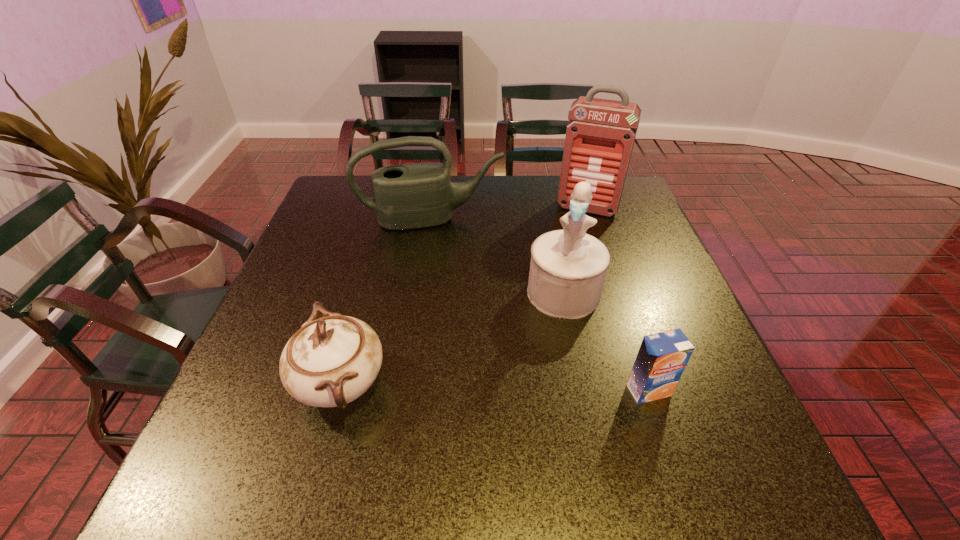
Find the location of a particular element. This screenshot has width=960, height=540. orange_juice present at the near edge is located at coordinates (662, 357).

What are the coordinates of `chinaware that is positioned at the left edge` in the screenshot? It's located at (329, 362).

Identify the location of watering can present at the left edge. (417, 195).

Identify the location of orange_juice present at the right edge. (662, 357).

This screenshot has width=960, height=540. What are the coordinates of `the first-aid kit positioned at the right edge` in the screenshot? It's located at (600, 135).

Find the location of `object located in the far left corner section of the desktop`. object located in the far left corner section of the desktop is located at coordinates (417, 195).

This screenshot has width=960, height=540. What are the coordinates of `object situated at the near left corner` in the screenshot? It's located at (329, 362).

Locate an element on the screen. The image size is (960, 540). object present at the far right corner is located at coordinates (600, 135).

Where is `object that is positioned at the near right corner`? The width and height of the screenshot is (960, 540). object that is positioned at the near right corner is located at coordinates (662, 357).

In order to click on vacant area at the far edge in this screenshot , I will do `click(492, 197)`.